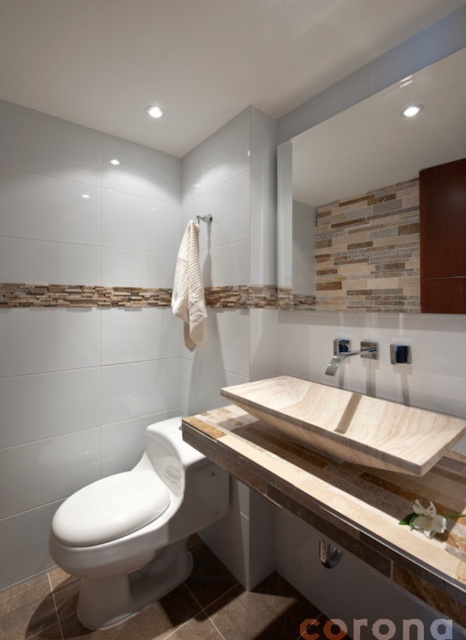
Measure the distance between light wood/wooden sink at center and camera.

light wood/wooden sink at center is 86.43 centimeters away from camera.

I want to click on light wood/wooden sink at center, so click(349, 422).

Between point (402, 230) and point (194, 488), which one is positioned in front?

Positioned in front is point (402, 230).

Does point (281, 228) come behind point (96, 486)?

Yes, point (281, 228) is behind point (96, 486).

This screenshot has height=640, width=466. Find the location of `wooden frame mirror at upper center`. wooden frame mirror at upper center is located at coordinates (365, 193).

Based on the photo, can you confirm if satin nickel faucet at upper center is wider than white ceramic shower at upper center?

Correct, the width of satin nickel faucet at upper center exceeds that of white ceramic shower at upper center.

Can you confirm if satin nickel faucet at upper center is positioned below white ceramic shower at upper center?

Correct, satin nickel faucet at upper center is located below white ceramic shower at upper center.

Where is `satin nickel faucet at upper center`? satin nickel faucet at upper center is located at coordinates (349, 353).